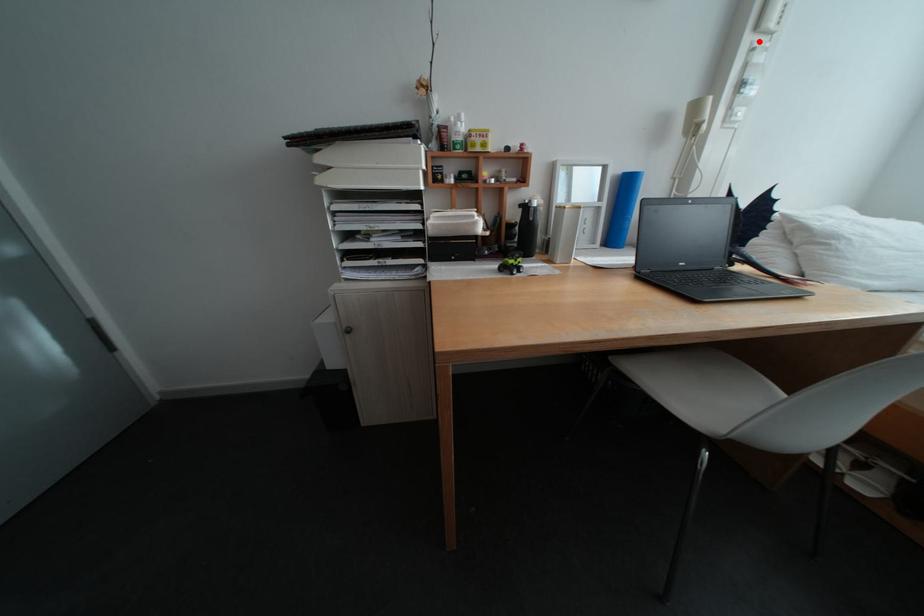
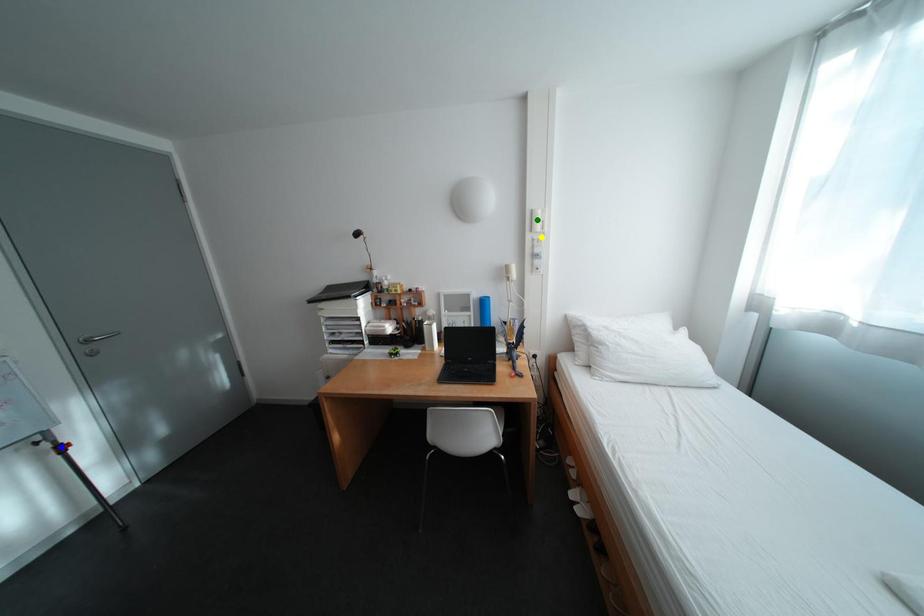
Question: I am providing you with two images of the same scene from different viewpoints. A red point is marked on the first image. You are given multiple points on the second image. Which mark in image 2 goes with the point in image 1?

Choices:
 (A) blue point
 (B) green point
 (C) yellow point

Answer: (C)